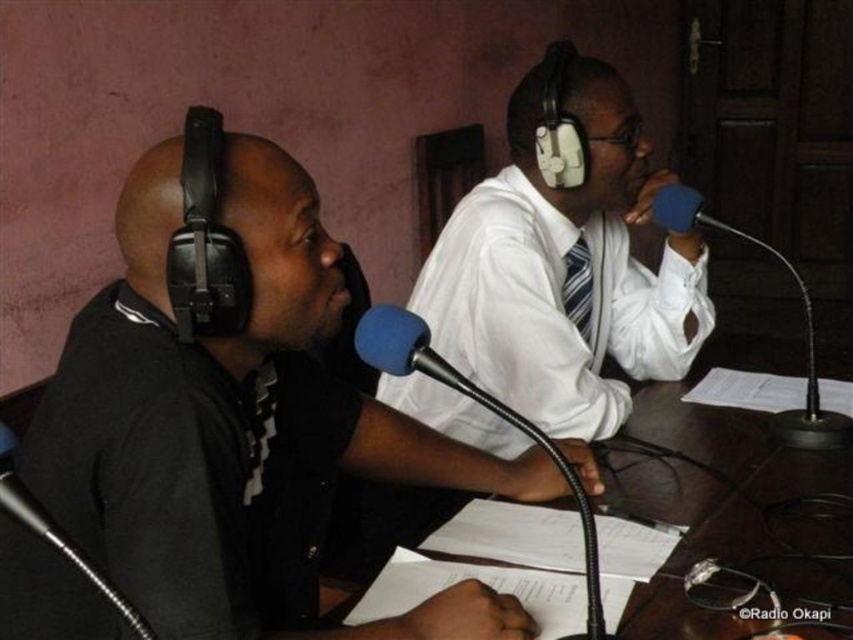
You are a sound technician in a radio studio. You need to adjust the microphone stand so that the blue foam microphone at center is closer to the striped fabric tie at center. Which direction should you move the microphone stand?

The striped fabric tie at center is on the left side of the blue foam microphone at center. To move the microphone closer to the tie, you should move the microphone stand to the left.

You are a sound technician in a radio studio. You need to adjust the height of the blue foam microphone at right and the blue foam microphone at center to ensure both are at the same level. Which microphone requires lowering and which needs raising?

The blue foam microphone at right is much taller than the blue foam microphone at center. Therefore, the blue foam microphone at right needs to be lowered, and the blue foam microphone at center needs to be raised to match their heights.

You are a sound technician in the studio. You need to adjust the microphone so that the white glossy shirt at center is visible to the camera without obstruction. Since the blue foam microphone at center is currently blocking the view, where should you move the microphone?

The white glossy shirt at center is below the blue foam microphone at center. To make the shirt visible, move the blue foam microphone at center upwards so it no longer blocks the shirt below.